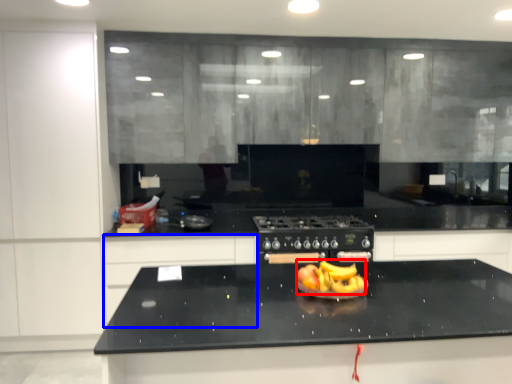
Question: Which point is further to the camera, fruit dish (highlighted by a red box) or cabinetry (highlighted by a blue box)?

Choices:
 (A) fruit dish
 (B) cabinetry

Answer: (B)